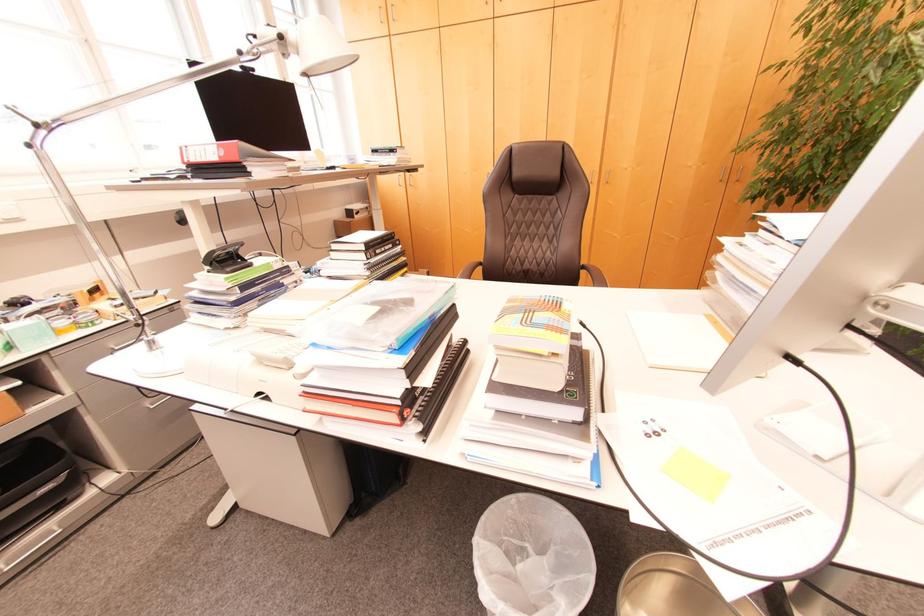
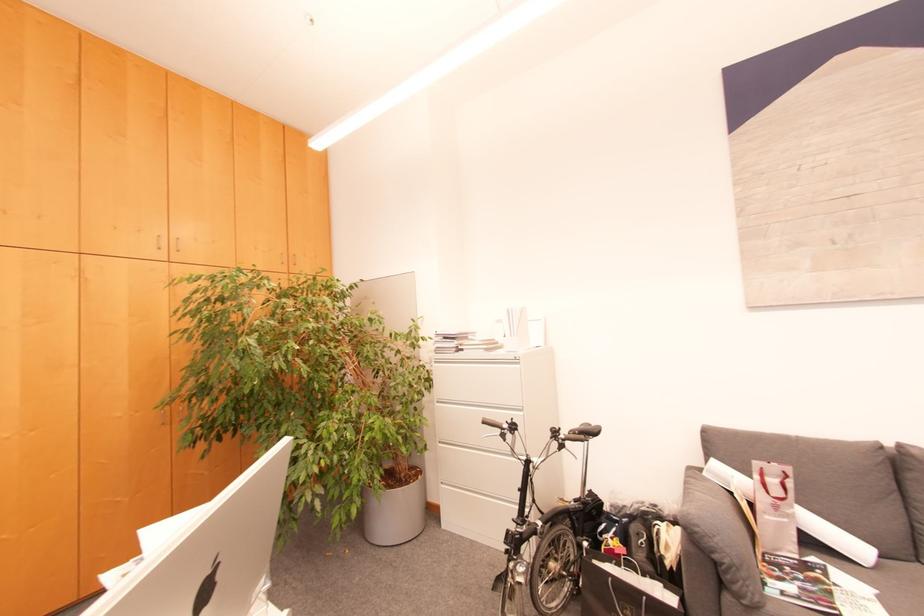
Question: The camera is either moving clockwise (left) or counter-clockwise (right) around the object. The first image is from the beginning of the video and the second image is from the end. Is the camera moving left or right when shooting the video?

Choices:
 (A) Left
 (B) Right

Answer: (A)